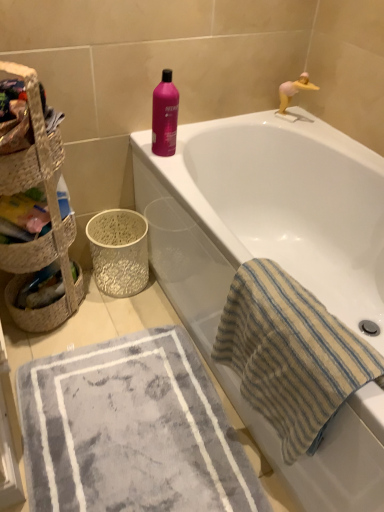
This screenshot has height=512, width=384. In order to click on blank space situated above woven straw basket at left, positioned as the second basket container in bottom-to-top order (from a real-world perspective) in this screenshot , I will do (14, 95).